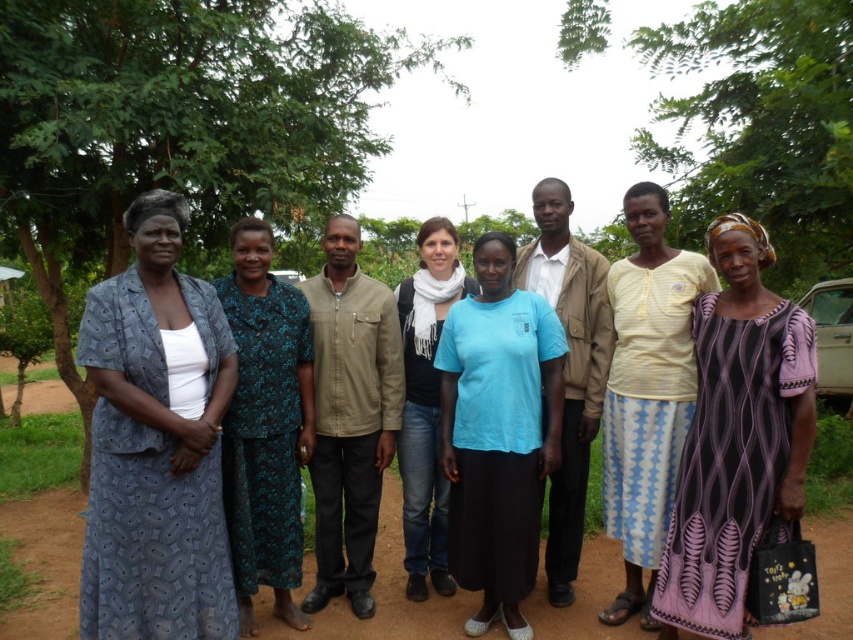
You are a photographer trying to capture a portrait of the khaki cotton jacket at center while ensuring the green leafy tree at left does not appear in the background. Based on their positions, is this possible?

The green leafy tree at left is above the khaki cotton jacket at center, so if you position the camera below the tree, you can frame the jacket without the tree in the background.

In the scene shown: You are standing in the middle of the dirt path and want to take a photo of both the point at (247, 141) and the point at (381, 353). Which point will appear closer to the camera in the photo?

The point at (247, 141) will appear closer to the camera in the photo because it is further to the camera than the point at (381, 353).

You are planning to take a photo of the khaki cotton jacket at center and the green leafy tree at left. Which object should you focus on first if you want to capture both in a single frame without moving the camera? Explain your reasoning based on their sizes.

The green leafy tree at left should be focused on first because its width is larger than the khaki cotton jacket at center, making it more prominent in the frame. By focusing on the larger object first, you can ensure both are captured effectively without needing to adjust the camera position.